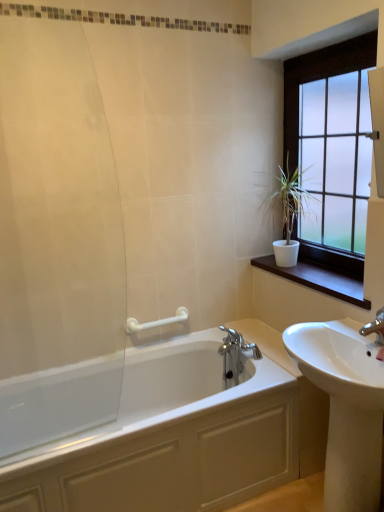
Find the location of a particular element. free space above satin glass window at upper right (from a real-world perspective) is located at coordinates (324, 48).